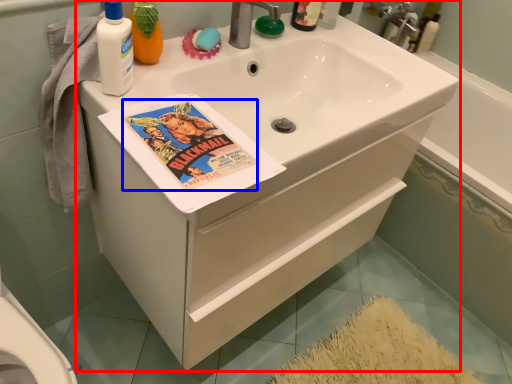
Question: Which object appears farthest to the camera in this image, bathroom cabinet (highlighted by a red box) or comic book character (highlighted by a blue box)?

Choices:
 (A) bathroom cabinet
 (B) comic book character

Answer: (A)